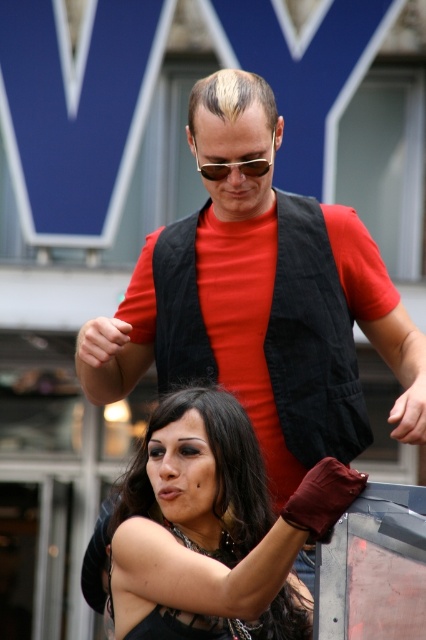
Question: Among these points, which one is farthest from the camera?

Choices:
 (A) (262, 355)
 (B) (167, 580)
 (C) (218, 164)

Answer: (A)

Question: Which is nearer to the matte black vest at upper center?

Choices:
 (A) sunglasses at center
 (B) shiny black hair at lower center

Answer: (A)

Question: Which object is closer to the camera taking this photo?

Choices:
 (A) matte black vest at upper center
 (B) shiny black hair at lower center

Answer: (B)

Question: Considering the relative positions of shiny black hair at lower center and sunglasses at center in the image provided, where is shiny black hair at lower center located with respect to sunglasses at center?

Choices:
 (A) below
 (B) above

Answer: (A)

Question: Does matte black vest at upper center appear on the right side of sunglasses at center?

Choices:
 (A) yes
 (B) no

Answer: (B)

Question: Where is matte black vest at upper center located in relation to sunglasses at center in the image?

Choices:
 (A) right
 (B) left

Answer: (B)